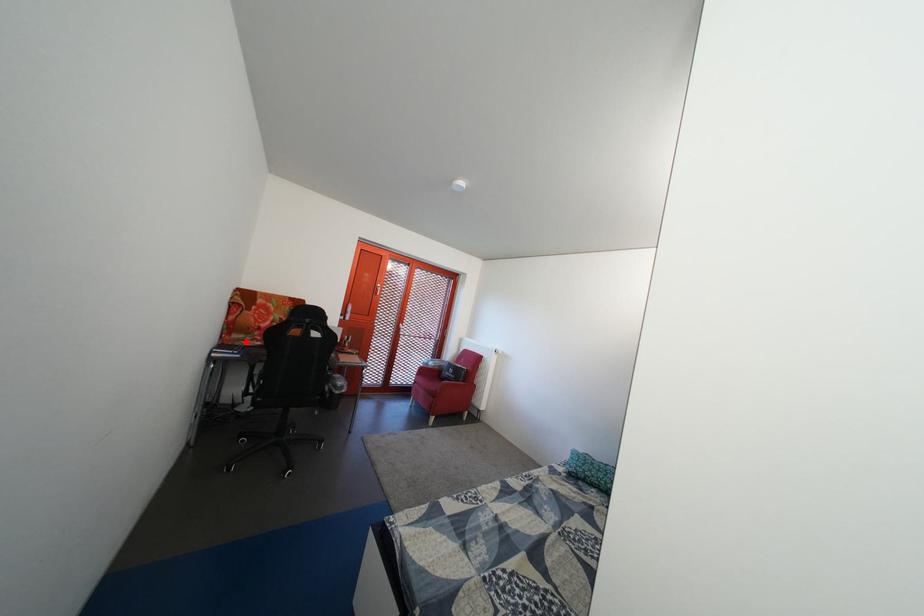
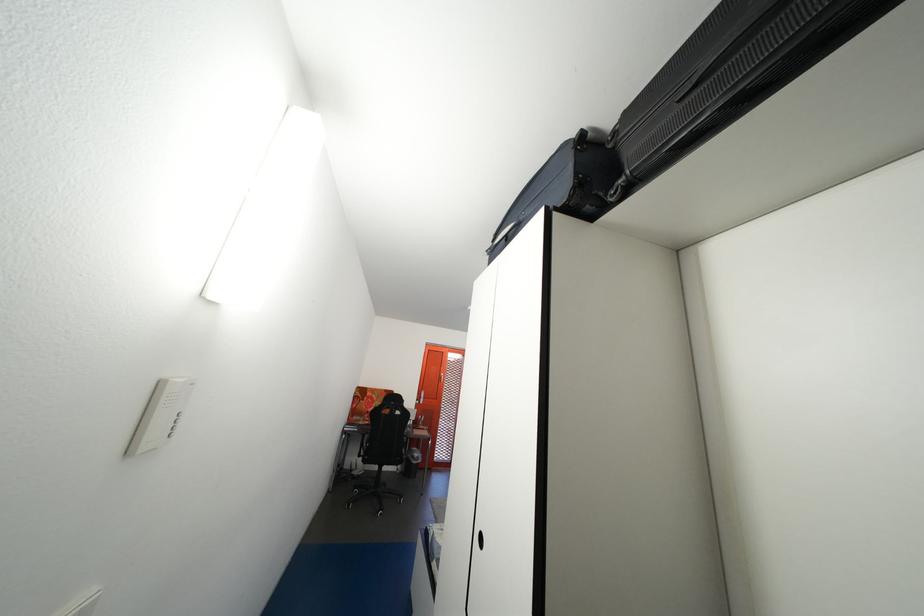
Question: I am providing you with two images of the same scene from different viewpoints. In image1, a red point is highlighted. Considering the same 3D point in image2, which of the following is correct?

Choices:
 (A) It is closer
 (B) It is farther

Answer: (B)